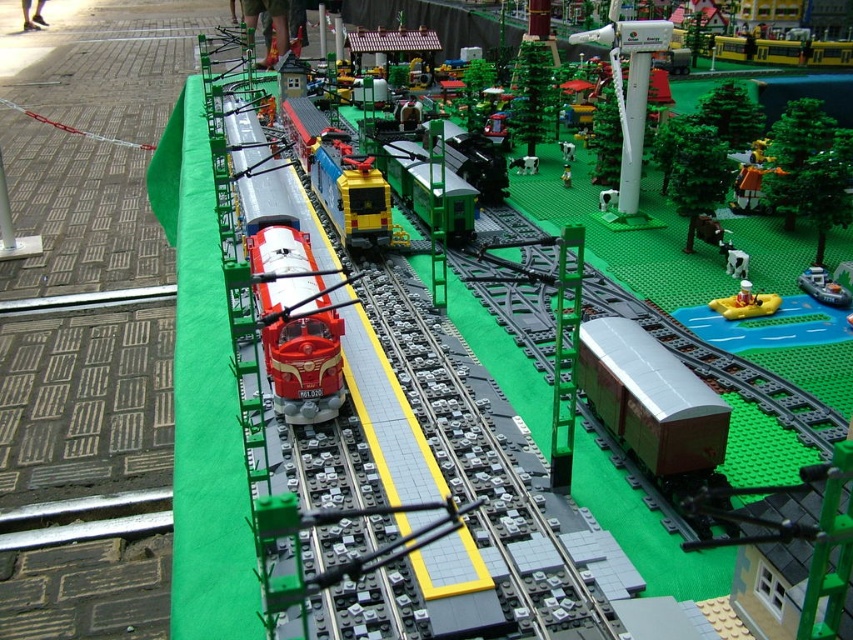
Question: Considering the real-world distances, which object is closest to the shiny yellow train at center?

Choices:
 (A) yellow rubber boat at lower right
 (B) brown matte cargo train at center

Answer: (B)

Question: Which point is farther to the camera?

Choices:
 (A) white plastic wind turbine at upper center
 (B) shiny red train at center
 (C) yellow rubber boat at lower right

Answer: (A)

Question: Does yellow rubber boat at center have a larger size compared to yellow rubber boat at lower right?

Choices:
 (A) yes
 (B) no

Answer: (B)

Question: From the image, what is the correct spatial relationship of brown matte cargo train at center in relation to shiny yellow train at center?

Choices:
 (A) right
 (B) left

Answer: (A)

Question: Is shiny yellow train at center to the left of white plastic wind turbine at upper center from the viewer's perspective?

Choices:
 (A) no
 (B) yes

Answer: (B)

Question: Which point is farther from the camera taking this photo?

Choices:
 (A) pyautogui.click(x=639, y=353)
 (B) pyautogui.click(x=762, y=310)
 (C) pyautogui.click(x=389, y=241)
 (D) pyautogui.click(x=836, y=300)

Answer: (C)